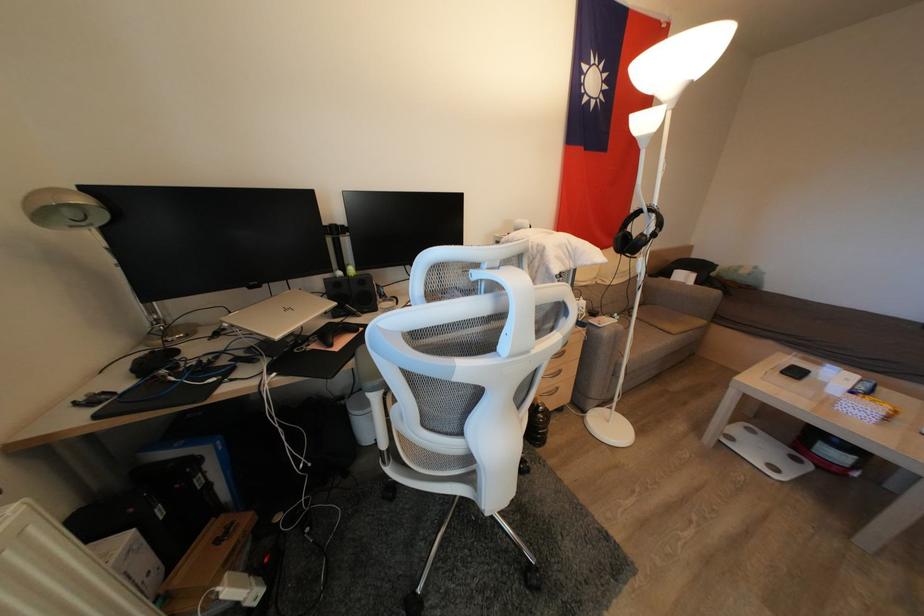
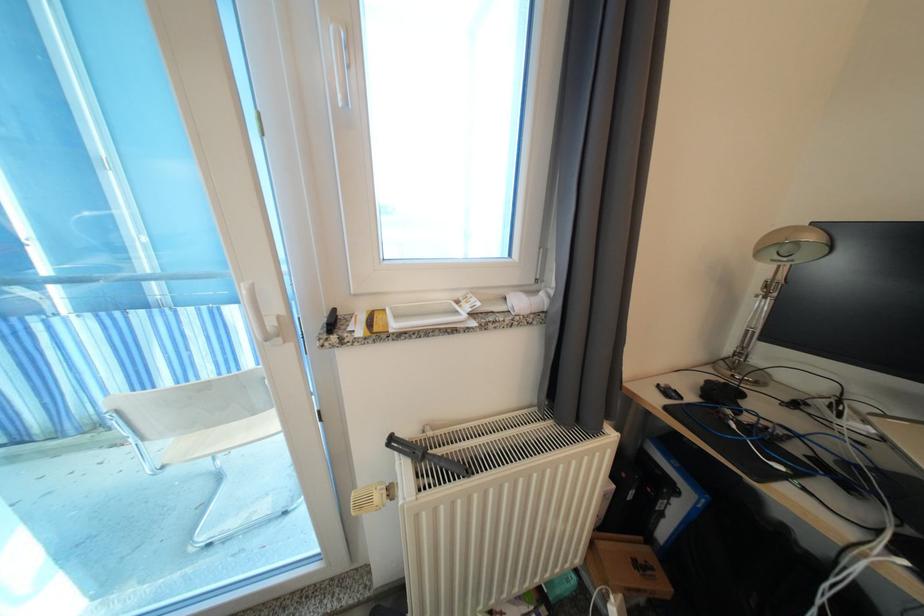
In the second image, find the point that corresponds to the point at 89,205 in the first image.

(818, 241)